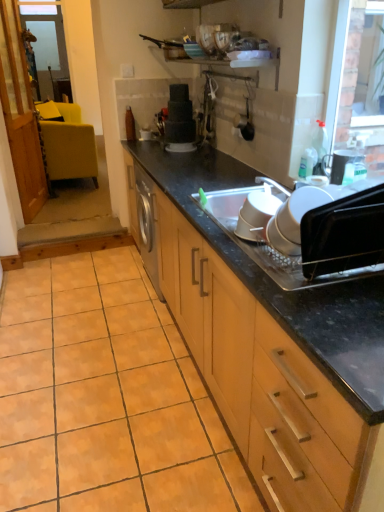
Question: Considering the positions of point (337, 159) and point (200, 492), is point (337, 159) closer or farther from the camera than point (200, 492)?

Choices:
 (A) closer
 (B) farther

Answer: (B)

Question: Considering the relative positions of matte black toaster at upper right, positioned as the 1th appliance in right-to-left order, and orange matte tile at lower left in the image provided, is matte black toaster at upper right, positioned as the 1th appliance in right-to-left order, to the left or to the right of orange matte tile at lower left?

Choices:
 (A) left
 (B) right

Answer: (B)

Question: Considering the real-world distances, which object is farthest from the orange matte tile at lower left?

Choices:
 (A) matte black toaster at upper right, the second appliance in the top-to-bottom sequence
 (B) white plastic bowls at center, marked as the second appliance in a left-to-right arrangement
 (C) wooden cabinet at center
 (D) matte yellow chair at left
 (E) black plastic oven at right, acting as the 2th appliance starting from the right

Answer: (D)

Question: Which of these objects is positioned closest to the matte black cake at center, which ranks as the 1th appliance in back-to-front order?

Choices:
 (A) transparent glass window screen at upper left
 (B) matte yellow chair at left
 (C) wooden cabinet at center
 (D) orange matte tile at lower left
 (E) black plastic oven at right, placed as the third appliance when sorted from left to right

Answer: (C)